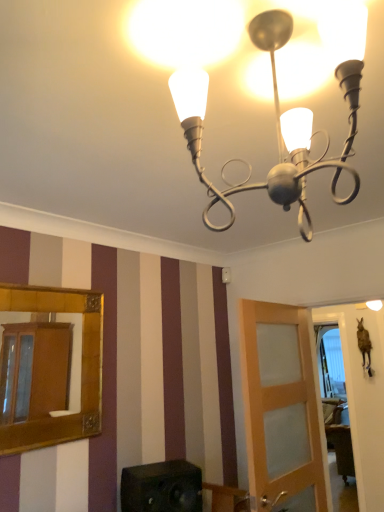
Question: Relative to black matte speaker at lower center, is metallic silver chandelier at upper center in front or behind?

Choices:
 (A) front
 (B) behind

Answer: (A)

Question: Is point (230, 212) closer or farther from the camera than point (198, 505)?

Choices:
 (A) farther
 (B) closer

Answer: (A)

Question: Estimate the real-world distances between objects in this image. Which object is farther from the black matte speaker at lower center?

Choices:
 (A) gold-framed mirror at left
 (B) light brown wooden door at center
 (C) metallic silver chandelier at upper center
 (D) transparent glass window at center

Answer: (D)

Question: Which is farther from the light brown wooden door at center?

Choices:
 (A) transparent glass window at center
 (B) gold-framed mirror at left
 (C) metallic silver chandelier at upper center
 (D) black matte speaker at lower center

Answer: (A)